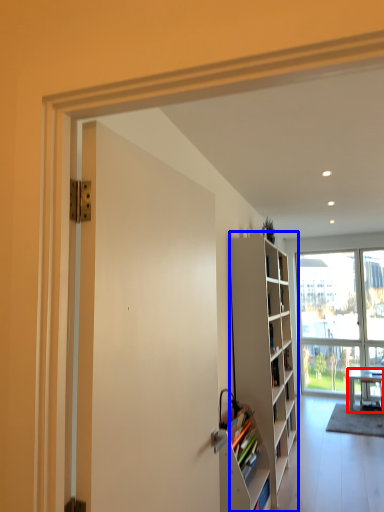
Question: Which of the following is the farthest to the observer, desk (highlighted by a red box) or cabinetry (highlighted by a blue box)?

Choices:
 (A) desk
 (B) cabinetry

Answer: (A)